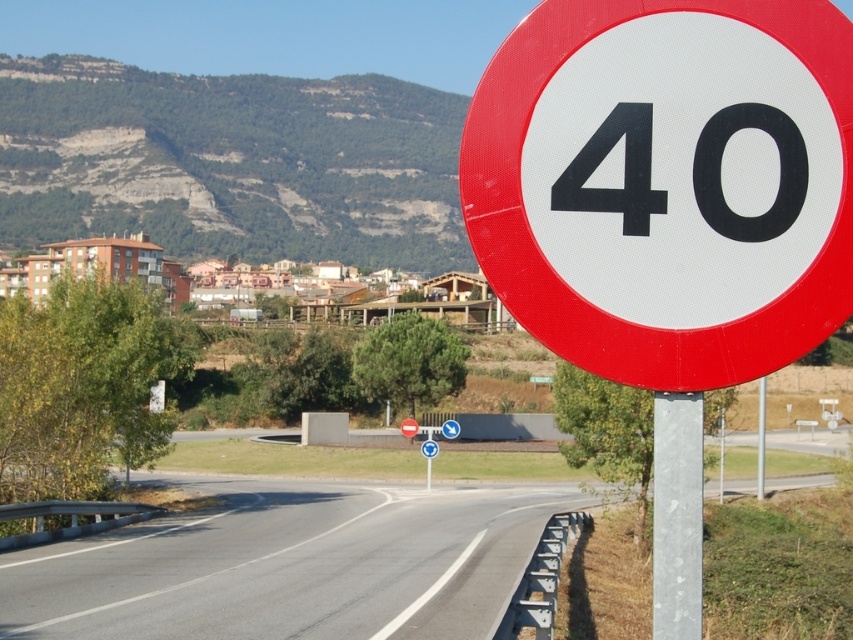
Can you confirm if asphalt road at center is positioned above blackmaterial/texture40 at upper right?

No, asphalt road at center is not above blackmaterial/texture40 at upper right.

What do you see at coordinates (289, 564) in the screenshot? This screenshot has width=853, height=640. I see `asphalt road at center` at bounding box center [289, 564].

This screenshot has width=853, height=640. Describe the element at coordinates (289, 564) in the screenshot. I see `asphalt road at center` at that location.

This screenshot has height=640, width=853. I want to click on asphalt road at center, so click(x=289, y=564).

Is point (683, 477) positioned in front of point (761, 474)?

Yes, it is.

Between metallic gray pole at center-right and metallic pole at center, which one is positioned lower?

metallic pole at center is below.

Is point (664, 544) positioned before point (757, 451)?

Yes, it is.

Locate an element on the screen. The image size is (853, 640). metallic gray pole at center-right is located at coordinates (677, 515).

Is red plastic speed limit sign at center wider than blackmaterial/texture40 at upper right?

Correct, the width of red plastic speed limit sign at center exceeds that of blackmaterial/texture40 at upper right.

Based on the photo, who is positioned more to the right, red plastic speed limit sign at center or blackmaterial/texture40 at upper right?

Positioned to the right is blackmaterial/texture40 at upper right.

Does point (756, 49) come behind point (567, 205)?

That is True.

Where is `red plastic speed limit sign at center`? Image resolution: width=853 pixels, height=640 pixels. red plastic speed limit sign at center is located at coordinates (665, 182).